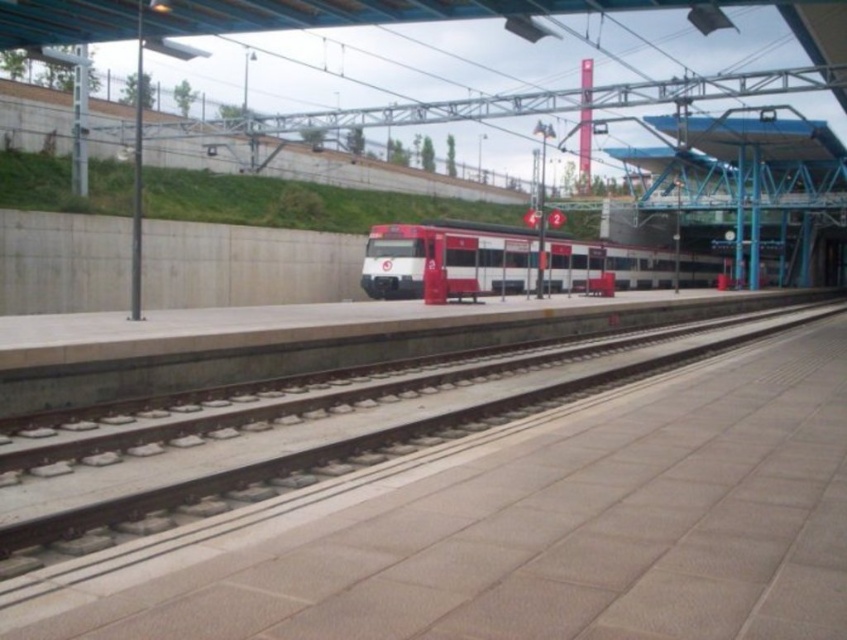
Does smooth concrete track at center appear on the right side of white glossy train at center?

In fact, smooth concrete track at center is to the left of white glossy train at center.

Can you confirm if smooth concrete track at center is positioned to the left of white glossy train at center?

Yes, smooth concrete track at center is to the left of white glossy train at center.

Where is `smooth concrete track at center`? smooth concrete track at center is located at coordinates (329, 458).